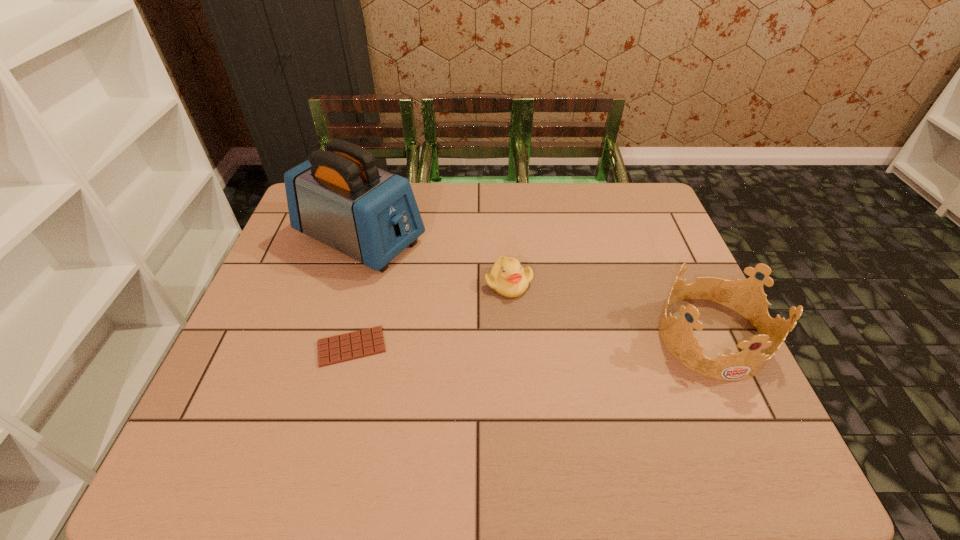
The image size is (960, 540). I want to click on vacant space situated 0.260m on the front-facing side of the tallest object, so click(x=491, y=298).

This screenshot has height=540, width=960. I want to click on free space located at the face of the third object from left to right, so pos(628,406).

The height and width of the screenshot is (540, 960). I want to click on free space located at the face of the third object from left to right, so click(x=621, y=399).

Find the location of a particular element. vacant space situated at the face of the third object from left to right is located at coordinates (586, 362).

I want to click on object positioned at the far edge, so click(x=338, y=196).

In order to click on object located at the left edge in this screenshot , I will do `click(338, 196)`.

The width and height of the screenshot is (960, 540). I want to click on object that is at the right edge, so click(x=746, y=297).

You are a GUI agent. You are given a task and a screenshot of the screen. Output one action in this format:
    pyautogui.click(x=<x>, y=<y>)
    Task: Click on the object at the far left corner
    Image resolution: width=960 pixels, height=540 pixels.
    Given the screenshot: What is the action you would take?
    pyautogui.click(x=338, y=196)

I want to click on blank space at the far edge of the desktop, so click(436, 217).

You are a GUI agent. You are given a task and a screenshot of the screen. Output one action in this format:
    pyautogui.click(x=<x>, y=<y>)
    Task: Click on the free region at the near edge of the desktop
    The width and height of the screenshot is (960, 540).
    Given the screenshot: What is the action you would take?
    pyautogui.click(x=516, y=413)